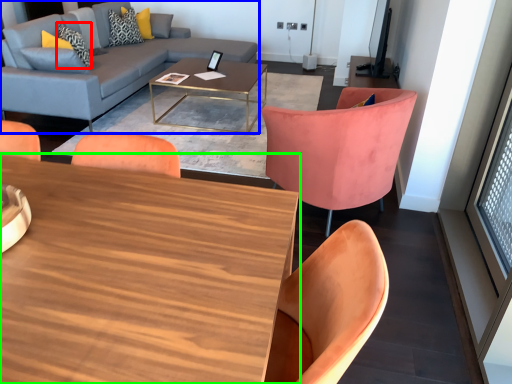
Question: Which is farther away from pillow (highlighted by a red box)? studio couch (highlighted by a blue box) or coffee table (highlighted by a green box)?

Choices:
 (A) studio couch
 (B) coffee table

Answer: (B)